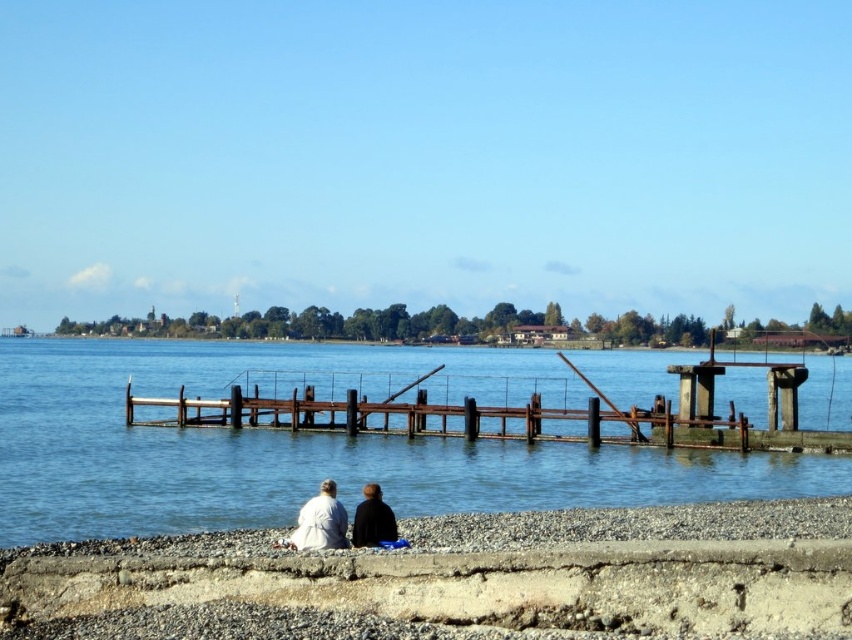
You are standing at the lakeside and want to reach a specific point marked at coordinates point (568, 436). If your maximum comfortable walking distance is 50 meters, will you be able to comfortably walk to that point?

The distance of point (568, 436) from camera is 54.47 meters, which exceeds your maximum comfortable walking distance of 50 meters. Therefore, you may not be able to comfortably walk to that point.

You are standing at the edge of the lake and want to reach the rusty metal dock at center. According to the coordinates provided, in which direction should you move relative to your current position?

The rusty metal dock at center is located at coordinates point (445, 417). Since you are at the edge of the lake, you should move towards the center of the lake to reach it.